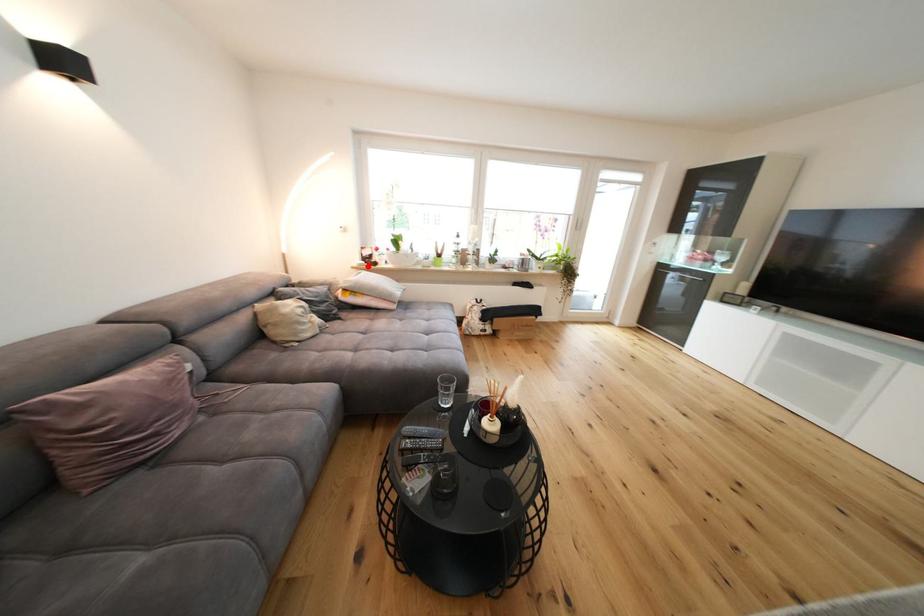
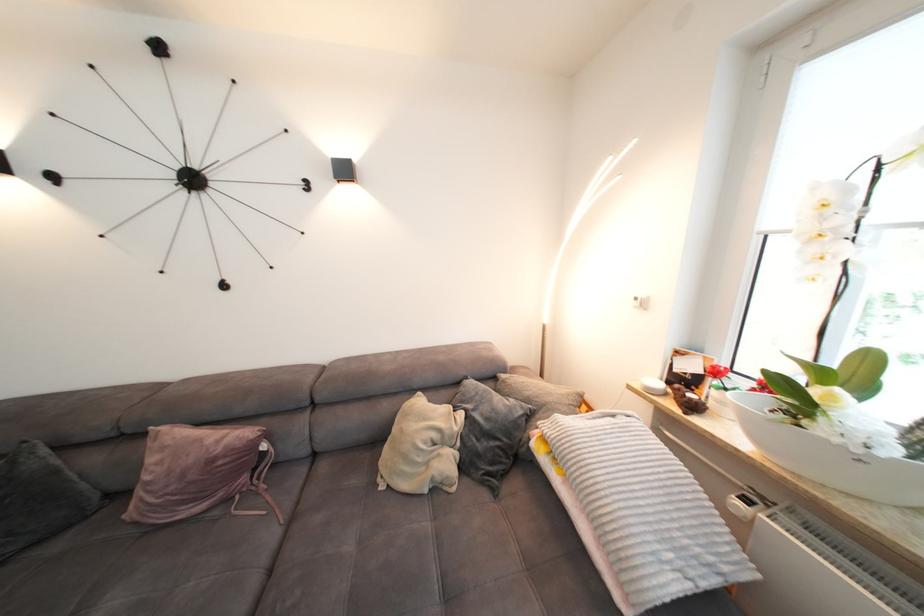
Locate, in the second image, the point that corresponds to the highlighted location in the first image.

(657, 391)